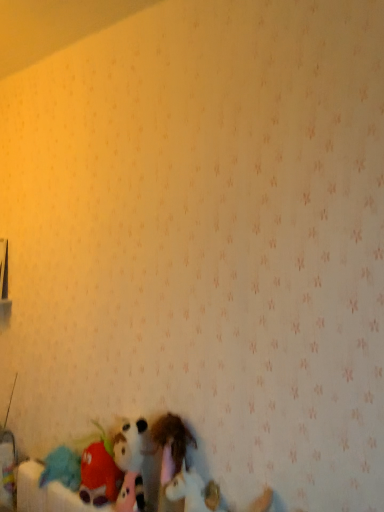
I want to click on fluffy plush toy at lower left, which ranks as the first toy in left-to-right order, so click(x=99, y=472).

What do you see at coordinates (189, 490) in the screenshot?
I see `white plush unicorn at lower center, which is counted as the first toy, starting from the right` at bounding box center [189, 490].

Where is `fluffy plush toy at lower left, which ranks as the first toy in left-to-right order`? fluffy plush toy at lower left, which ranks as the first toy in left-to-right order is located at coordinates (99, 472).

Which of these two, fuzzy fabric stuffed animal at lower center, positioned as the 2th toy in right-to-left order, or white plush unicorn at lower center, which is counted as the first toy, starting from the right, is thinner?

white plush unicorn at lower center, which is counted as the first toy, starting from the right, is thinner.

Is fuzzy fabric stuffed animal at lower center, the second toy viewed from the left, far away from white plush unicorn at lower center, which is counted as the first toy, starting from the right?

No.

Does fuzzy fabric stuffed animal at lower center, positioned as the 2th toy in right-to-left order, turn towards white plush unicorn at lower center, which is counted as the first toy, starting from the right?

No, fuzzy fabric stuffed animal at lower center, positioned as the 2th toy in right-to-left order, is not aimed at white plush unicorn at lower center, which is counted as the first toy, starting from the right.

Is fluffy plush toy at lower left, which ranks as the first toy in left-to-right order, to the left of white plush unicorn at lower center, which is counted as the first toy, starting from the right, from the viewer's perspective?

Yes.

Is fluffy plush toy at lower left, which ranks as the first toy in left-to-right order, facing away from white plush unicorn at lower center, which is counted as the first toy, starting from the right?

fluffy plush toy at lower left, which ranks as the first toy in left-to-right order, does not have its back to white plush unicorn at lower center, which is counted as the first toy, starting from the right.

Would you say fluffy plush toy at lower left, which ranks as the first toy in left-to-right order, contains white plush unicorn at lower center, the third toy from the left?

No, white plush unicorn at lower center, the third toy from the left, is not inside fluffy plush toy at lower left, which ranks as the first toy in left-to-right order.

From the image's perspective, relative to white plush unicorn at lower center, the third toy from the left, is fluffy plush toy at lower left, which ranks as the first toy in left-to-right order, above or below?

fluffy plush toy at lower left, which ranks as the first toy in left-to-right order, is above white plush unicorn at lower center, the third toy from the left.

Considering the relative sizes of white plush unicorn at lower center, the third toy from the left, and fluffy plush toy at lower left, which ranks as the first toy in left-to-right order, in the image provided, is white plush unicorn at lower center, the third toy from the left, shorter than fluffy plush toy at lower left, which ranks as the first toy in left-to-right order,?

Correct, white plush unicorn at lower center, the third toy from the left, is not as tall as fluffy plush toy at lower left, which ranks as the first toy in left-to-right order.

Can you confirm if white plush unicorn at lower center, which is counted as the first toy, starting from the right, is smaller than fluffy plush toy at lower left, the 3th toy from the right?

Yes.

Which object is further away from the camera, white plush unicorn at lower center, the third toy from the left, or fluffy plush toy at lower left, the 3th toy from the right?

fluffy plush toy at lower left, the 3th toy from the right, is behind.

From the picture: Is fluffy plush toy at lower left, the 3th toy from the right, taller or shorter than fuzzy fabric stuffed animal at lower center, positioned as the 2th toy in right-to-left order?

fluffy plush toy at lower left, the 3th toy from the right, is shorter than fuzzy fabric stuffed animal at lower center, positioned as the 2th toy in right-to-left order.

Would you say fluffy plush toy at lower left, which ranks as the first toy in left-to-right order, is outside fuzzy fabric stuffed animal at lower center, the second toy viewed from the left?

Absolutely, fluffy plush toy at lower left, which ranks as the first toy in left-to-right order, is external to fuzzy fabric stuffed animal at lower center, the second toy viewed from the left.

Considering the sizes of fluffy plush toy at lower left, the 3th toy from the right, and fuzzy fabric stuffed animal at lower center, positioned as the 2th toy in right-to-left order, in the image, is fluffy plush toy at lower left, the 3th toy from the right, wider or thinner than fuzzy fabric stuffed animal at lower center, positioned as the 2th toy in right-to-left order,?

Considering their sizes, fluffy plush toy at lower left, the 3th toy from the right, looks broader than fuzzy fabric stuffed animal at lower center, positioned as the 2th toy in right-to-left order.

From the image's perspective, is fuzzy fabric stuffed animal at lower center, positioned as the 2th toy in right-to-left order, beneath fluffy plush toy at lower left, the 3th toy from the right?

No, from the image's perspective, fuzzy fabric stuffed animal at lower center, positioned as the 2th toy in right-to-left order, is not beneath fluffy plush toy at lower left, the 3th toy from the right.

From a real-world perspective, between fuzzy fabric stuffed animal at lower center, the second toy viewed from the left, and fluffy plush toy at lower left, the 3th toy from the right, who is vertically lower?

fluffy plush toy at lower left, the 3th toy from the right, from a real-world perspective.

Which of these two, fuzzy fabric stuffed animal at lower center, positioned as the 2th toy in right-to-left order, or fluffy plush toy at lower left, the 3th toy from the right, is wider?

fluffy plush toy at lower left, the 3th toy from the right, is wider.

Which is in front, point (177, 471) or point (99, 468)?

Positioned in front is point (177, 471).

Can you tell me how much white plush unicorn at lower center, the third toy from the left, and fuzzy fabric stuffed animal at lower center, the second toy viewed from the left, differ in facing direction?

The angle between the facing direction of white plush unicorn at lower center, the third toy from the left, and the facing direction of fuzzy fabric stuffed animal at lower center, the second toy viewed from the left, is 0.000698 degrees.

Is fuzzy fabric stuffed animal at lower center, the second toy viewed from the left, at the back of white plush unicorn at lower center, which is counted as the first toy, starting from the right?

No.

Does white plush unicorn at lower center, which is counted as the first toy, starting from the right, have a larger size compared to fuzzy fabric stuffed animal at lower center, the second toy viewed from the left?

Incorrect, white plush unicorn at lower center, which is counted as the first toy, starting from the right, is not larger than fuzzy fabric stuffed animal at lower center, the second toy viewed from the left.

Which is in front, white plush unicorn at lower center, the third toy from the left, or fuzzy fabric stuffed animal at lower center, positioned as the 2th toy in right-to-left order?

Positioned in front is white plush unicorn at lower center, the third toy from the left.

From the image's perspective, count 2nd toys downward from the fuzzy fabric stuffed animal at lower center, positioned as the 2th toy in right-to-left order, and point to it. Please provide its 2D coordinates.

[(189, 490)]

You are a GUI agent. You are given a task and a screenshot of the screen. Output one action in this format:
    pyautogui.click(x=<x>, y=<y>)
    Task: Click on the 2nd toy behind the white plush unicorn at lower center, which is counted as the first toy, starting from the right
    This screenshot has height=512, width=384.
    Given the screenshot: What is the action you would take?
    pyautogui.click(x=99, y=472)

From the picture: From the image, which object appears to be nearer to white plush unicorn at lower center, which is counted as the first toy, starting from the right, fluffy plush toy at lower left, the 3th toy from the right, or fuzzy fabric stuffed animal at lower center, positioned as the 2th toy in right-to-left order?

Among the two, fuzzy fabric stuffed animal at lower center, positioned as the 2th toy in right-to-left order, is located nearer to white plush unicorn at lower center, which is counted as the first toy, starting from the right.

Based on their spatial positions, is fuzzy fabric stuffed animal at lower center, positioned as the 2th toy in right-to-left order, or white plush unicorn at lower center, which is counted as the first toy, starting from the right, further from fluffy plush toy at lower left, which ranks as the first toy in left-to-right order?

Based on the image, white plush unicorn at lower center, which is counted as the first toy, starting from the right, appears to be further to fluffy plush toy at lower left, which ranks as the first toy in left-to-right order.

Considering their positions, is fuzzy fabric stuffed animal at lower center, positioned as the 2th toy in right-to-left order, positioned closer to white plush unicorn at lower center, which is counted as the first toy, starting from the right, than fluffy plush toy at lower left, the 3th toy from the right?

The object closer to white plush unicorn at lower center, which is counted as the first toy, starting from the right, is fuzzy fabric stuffed animal at lower center, positioned as the 2th toy in right-to-left order.

Looking at this image, estimate the real-world distances between objects in this image. Which object is further from fuzzy fabric stuffed animal at lower center, positioned as the 2th toy in right-to-left order, white plush unicorn at lower center, the third toy from the left, or fluffy plush toy at lower left, which ranks as the first toy in left-to-right order?

fluffy plush toy at lower left, which ranks as the first toy in left-to-right order, lies further to fuzzy fabric stuffed animal at lower center, positioned as the 2th toy in right-to-left order, than the other object.

Consider the image. Looking at the image, which one is located closer to fluffy plush toy at lower left, which ranks as the first toy in left-to-right order, white plush unicorn at lower center, the third toy from the left, or fuzzy fabric stuffed animal at lower center, the second toy viewed from the left?

The object closer to fluffy plush toy at lower left, which ranks as the first toy in left-to-right order, is fuzzy fabric stuffed animal at lower center, the second toy viewed from the left.

When comparing their distances from fuzzy fabric stuffed animal at lower center, the second toy viewed from the left, does fluffy plush toy at lower left, the 3th toy from the right, or white plush unicorn at lower center, the third toy from the left, seem closer?

Among the two, white plush unicorn at lower center, the third toy from the left, is located nearer to fuzzy fabric stuffed animal at lower center, the second toy viewed from the left.

Find the location of a particular element. This screenshot has width=384, height=512. toy between fluffy plush toy at lower left, which ranks as the first toy in left-to-right order, and white plush unicorn at lower center, the third toy from the left, from left to right is located at coordinates (170, 453).